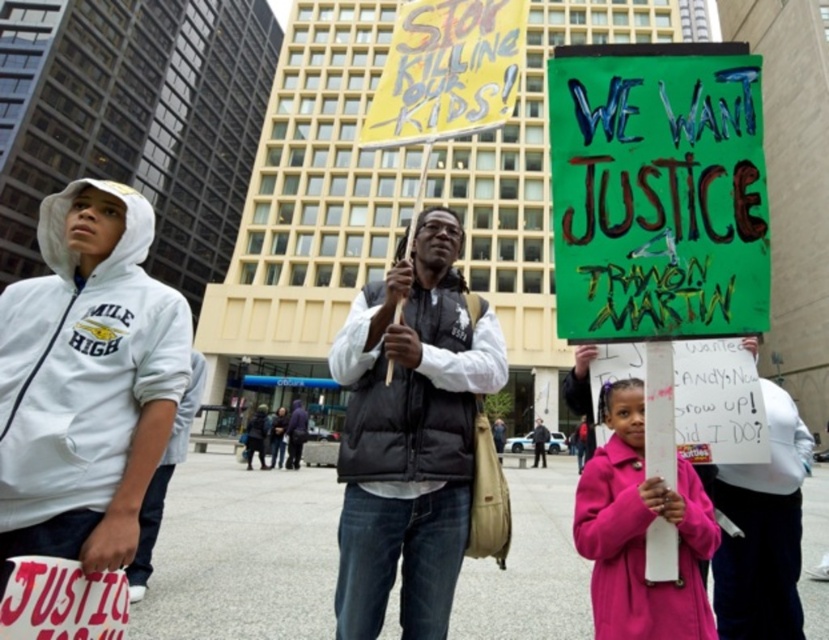
Question: Which point is farther from the camera taking this photo?

Choices:
 (A) (457, 221)
 (B) (49, 413)

Answer: (A)

Question: Can you confirm if green painted cardboard sign at center is bigger than pink fabric coat at lower right?

Choices:
 (A) no
 (B) yes

Answer: (A)

Question: Which of the following is the closest to the observer?

Choices:
 (A) white fleece sweatshirt at left
 (B) pink fabric coat at lower right

Answer: (B)

Question: Can you confirm if black quilted vest at center is positioned below pink fabric coat at lower right?

Choices:
 (A) no
 (B) yes

Answer: (A)

Question: Is black quilted vest at center thinner than white fleece sweatshirt at left?

Choices:
 (A) yes
 (B) no

Answer: (A)

Question: Which object is the farthest from the black quilted vest at center?

Choices:
 (A) pink fabric coat at lower right
 (B) white fleece sweatshirt at left
 (C) green painted cardboard sign at center

Answer: (B)